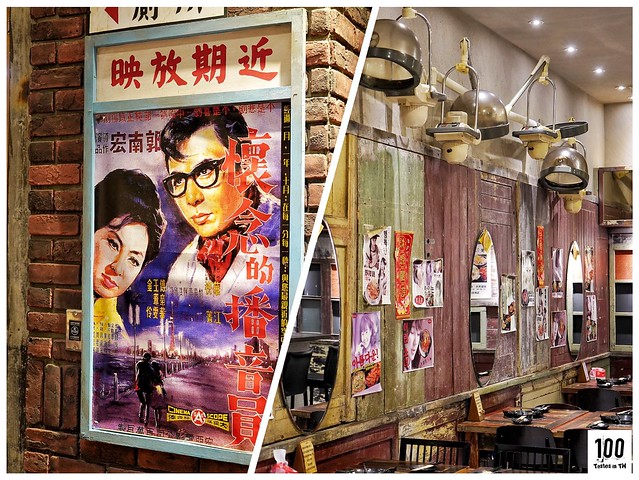
Where is `1st hairdryer`? 1st hairdryer is located at coordinates (390, 59).